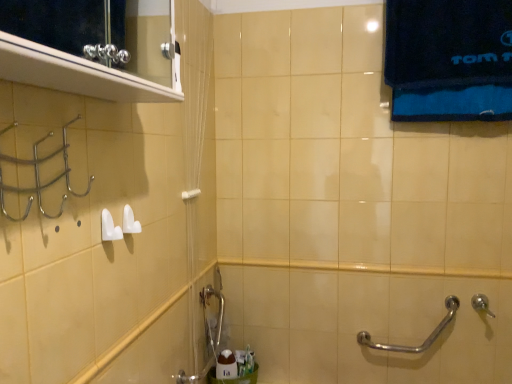
At what (x,y) coordinates should I click in order to perform the action: click on silver metallic shower at lower right. Please return your answer as a coordinate pair (x, y). The height and width of the screenshot is (384, 512). Looking at the image, I should click on (481, 304).

The height and width of the screenshot is (384, 512). What do you see at coordinates (424, 341) in the screenshot? I see `silver metallic grab bar at lower right` at bounding box center [424, 341].

Where is `dark blue cotton towel at upper right`? The height and width of the screenshot is (384, 512). dark blue cotton towel at upper right is located at coordinates (449, 59).

Where is `white plastic towel bar at upper center`? The image size is (512, 384). white plastic towel bar at upper center is located at coordinates (190, 194).

This screenshot has width=512, height=384. Describe the element at coordinates (93, 47) in the screenshot. I see `metallic silver medicine cabinet at upper left` at that location.

This screenshot has width=512, height=384. I want to click on white glossy soap at lower center, so click(226, 365).

Locate an element on the screen. The height and width of the screenshot is (384, 512). brushed metal faucet at lower center is located at coordinates (207, 332).

Looking at this image, is silver metallic grab bar at lower right inside or outside of white glossy soap at lower center?

silver metallic grab bar at lower right is not enclosed by white glossy soap at lower center.

Considering the sizes of silver metallic grab bar at lower right and white glossy soap at lower center in the image, is silver metallic grab bar at lower right bigger or smaller than white glossy soap at lower center?

Clearly, silver metallic grab bar at lower right is larger in size than white glossy soap at lower center.

Between silver metallic grab bar at lower right and white glossy soap at lower center, which one has more height?

silver metallic grab bar at lower right.

At what (x,y) coordinates should I click in order to perform the action: click on plumbing fixture in front of the dark blue cotton towel at upper right. Please return your answer as a coordinate pair (x, y). Looking at the image, I should click on (207, 332).

Does point (209, 337) come behind point (407, 61)?

Yes, point (209, 337) is behind point (407, 61).

From a real-world perspective, is brushed metal faucet at lower center above or below dark blue cotton towel at upper right?

brushed metal faucet at lower center is situated lower than dark blue cotton towel at upper right in the real world.

Consider the image. Can you confirm if brushed metal faucet at lower center is bigger than dark blue cotton towel at upper right?

Actually, brushed metal faucet at lower center might be smaller than dark blue cotton towel at upper right.

Does brushed metal faucet at lower center appear on the left side of silver metallic shower at lower right?

Correct, you'll find brushed metal faucet at lower center to the left of silver metallic shower at lower right.

Which is in front, brushed metal faucet at lower center or silver metallic shower at lower right?

brushed metal faucet at lower center is closer to the camera.

From the image's perspective, is brushed metal faucet at lower center located beneath silver metallic shower at lower right?

Correct, brushed metal faucet at lower center appears lower than silver metallic shower at lower right in the image.

Can we say brushed metal faucet at lower center lies outside silver metallic shower at lower right?

Yes.

Where is `medicine cabinet above the brushed metal faucet at lower center (from a real-world perspective)`? Image resolution: width=512 pixels, height=384 pixels. medicine cabinet above the brushed metal faucet at lower center (from a real-world perspective) is located at coordinates (93, 47).

Considering the relative sizes of brushed metal faucet at lower center and metallic silver medicine cabinet at upper left in the image provided, is brushed metal faucet at lower center bigger than metallic silver medicine cabinet at upper left?

No.

Is brushed metal faucet at lower center surrounding metallic silver medicine cabinet at upper left?

Actually, metallic silver medicine cabinet at upper left is outside brushed metal faucet at lower center.

How different are the orientations of brushed metal faucet at lower center and metallic silver medicine cabinet at upper left in degrees?

They differ by 0.551 degrees in their facing directions.

Which is nearer, (482, 297) or (227, 367)?

Clearly, point (482, 297) is closer to the camera than point (227, 367).

Based on the photo, between silver metallic shower at lower right and white glossy soap at lower center, which one has larger size?

Bigger between the two is white glossy soap at lower center.

From a real-world perspective, which is physically below, silver metallic shower at lower right or white glossy soap at lower center?

white glossy soap at lower center.

Does silver metallic shower at lower right come in front of white glossy soap at lower center?

Yes, the depth of silver metallic shower at lower right is less than that of white glossy soap at lower center.

Between metallic silver medicine cabinet at upper left and silver metallic shower at lower right, which one has larger width?

Wider between the two is metallic silver medicine cabinet at upper left.

Considering the positions of objects metallic silver medicine cabinet at upper left and silver metallic shower at lower right in the image provided, who is more to the right, metallic silver medicine cabinet at upper left or silver metallic shower at lower right?

silver metallic shower at lower right.

Who is shorter, metallic silver medicine cabinet at upper left or silver metallic shower at lower right?

silver metallic shower at lower right.

From a real-world perspective, which object rests below the other?

From a 3D spatial view, silver metallic shower at lower right is below.

Consider the image. Is the position of white plastic towel bar at upper center more distant than that of silver metallic shower at lower right?

No, white plastic towel bar at upper center is closer to the viewer.

This screenshot has height=384, width=512. Identify the location of shower that is below the white plastic towel bar at upper center (from the image's perspective). (481, 304).

From the picture: Can you confirm if white plastic towel bar at upper center is positioned to the left of silver metallic shower at lower right?

Indeed, white plastic towel bar at upper center is positioned on the left side of silver metallic shower at lower right.

In the image, there is a silver metallic grab bar at lower right. Where is `toiletry below it (from a real-world perspective)`? The height and width of the screenshot is (384, 512). toiletry below it (from a real-world perspective) is located at coordinates (226, 365).

Locate an element on the screen. The image size is (512, 384). bath towel above the brushed metal faucet at lower center (from the image's perspective) is located at coordinates (449, 59).

Estimate the real-world distances between objects in this image. Which object is further from brushed metal faucet at lower center, dark blue cotton towel at upper right or white glossy soap at lower center?

dark blue cotton towel at upper right lies further to brushed metal faucet at lower center than the other object.

Estimate the real-world distances between objects in this image. Which object is further from brushed metal faucet at lower center, white plastic towel bar at upper center or silver metallic grab bar at lower right?

silver metallic grab bar at lower right is further to brushed metal faucet at lower center.

From the image, which object appears to be nearer to dark blue cotton towel at upper right, silver metallic shower at lower right or brushed metal faucet at lower center?

The object closer to dark blue cotton towel at upper right is silver metallic shower at lower right.

From the image, which object appears to be farther from dark blue cotton towel at upper right, silver metallic shower at lower right or metallic silver medicine cabinet at upper left?

Based on the image, metallic silver medicine cabinet at upper left appears to be further to dark blue cotton towel at upper right.

When comparing their distances from white glossy soap at lower center, does metallic silver medicine cabinet at upper left or silver metallic grab bar at lower right seem closer?

silver metallic grab bar at lower right is closer to white glossy soap at lower center.

When comparing their distances from brushed metal faucet at lower center, does silver metallic shower at lower right or metallic silver medicine cabinet at upper left seem closer?

Based on the image, metallic silver medicine cabinet at upper left appears to be nearer to brushed metal faucet at lower center.

Looking at this image, considering their positions, is white glossy soap at lower center positioned closer to dark blue cotton towel at upper right than metallic silver medicine cabinet at upper left?

Based on the image, metallic silver medicine cabinet at upper left appears to be nearer to dark blue cotton towel at upper right.

Looking at the image, which one is located closer to dark blue cotton towel at upper right, silver metallic grab bar at lower right or metallic silver medicine cabinet at upper left?

silver metallic grab bar at lower right lies closer to dark blue cotton towel at upper right than the other object.

Locate an element on the screen. This screenshot has height=384, width=512. shower between dark blue cotton towel at upper right and silver metallic grab bar at lower right in the vertical direction is located at coordinates (481, 304).

The height and width of the screenshot is (384, 512). I want to click on toiletry between white plastic towel bar at upper center and silver metallic grab bar at lower right in the horizontal direction, so click(226, 365).

Identify the location of towel bar between metallic silver medicine cabinet at upper left and white glossy soap at lower center from front to back. The width and height of the screenshot is (512, 384). (190, 194).

Locate an element on the screen. The width and height of the screenshot is (512, 384). plumbing fixture located between metallic silver medicine cabinet at upper left and dark blue cotton towel at upper right in the depth direction is located at coordinates [207, 332].